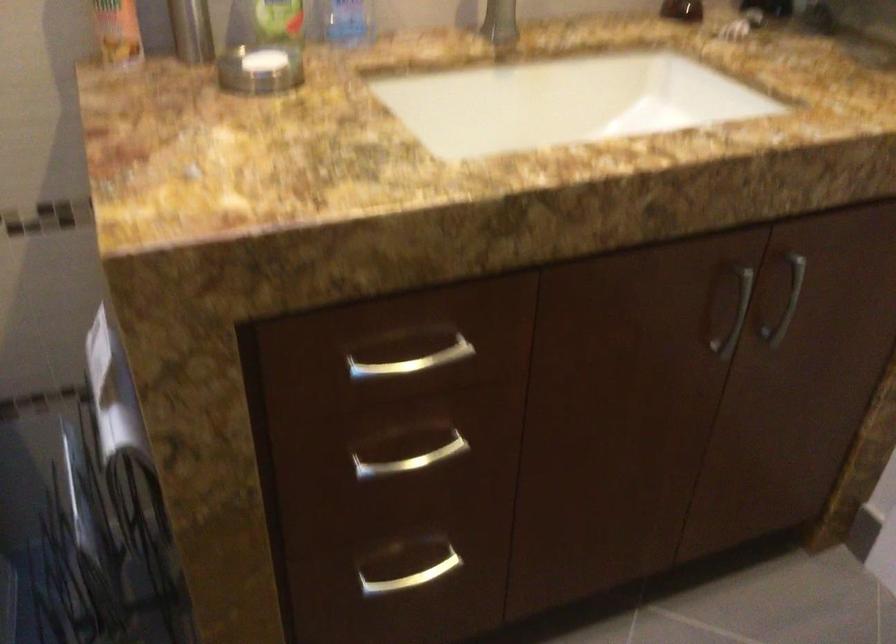
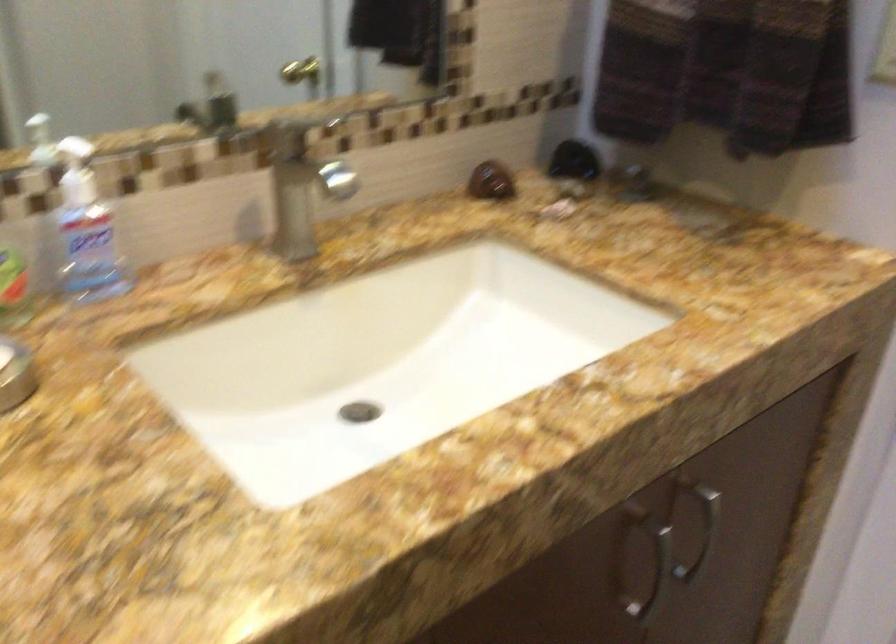
Question: The images are taken continuously from a first-person perspective. In which direction is your viewpoint rotating?

Choices:
 (A) Left
 (B) Right
 (C) Up
 (D) Down

Answer: (B)